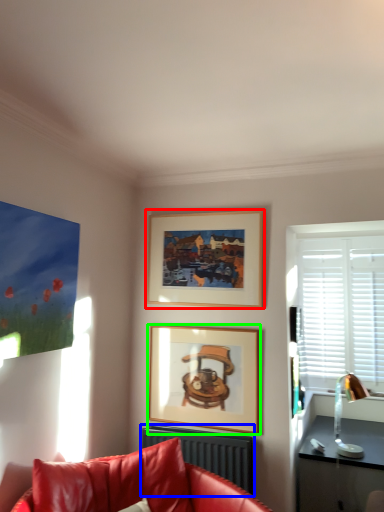
Question: Considering the real-world distances, which object is closest to picture frame (highlighted by a red box)? radiator (highlighted by a blue box) or picture frame (highlighted by a green box).

Choices:
 (A) radiator
 (B) picture frame

Answer: (B)